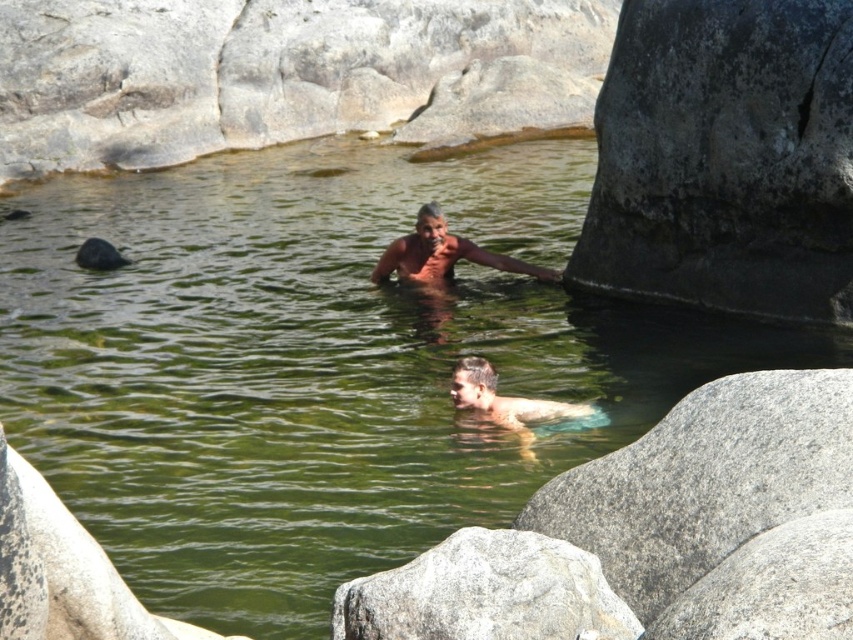
Question: Which object appears closest to the camera in this image?

Choices:
 (A) smooth skin man at center
 (B) gray rough rock at lower center
 (C) brown skin at center

Answer: (B)

Question: From the image, what is the correct spatial relationship of gray rough rock at lower center in relation to brown skin at center?

Choices:
 (A) above
 (B) below

Answer: (B)

Question: Which of the following is the closest to the observer?

Choices:
 (A) brown skin at center
 (B) gray rough rock at lower center

Answer: (B)

Question: Which point is farther from the camera taking this photo?

Choices:
 (A) (x=459, y=244)
 (B) (x=686, y=426)
 (C) (x=642, y=61)
 (D) (x=494, y=598)

Answer: (A)

Question: Is gray rough rock at right wider than brown skin at center?

Choices:
 (A) yes
 (B) no

Answer: (A)

Question: Is gray rough rock at lower center above brown skin at center?

Choices:
 (A) no
 (B) yes

Answer: (A)